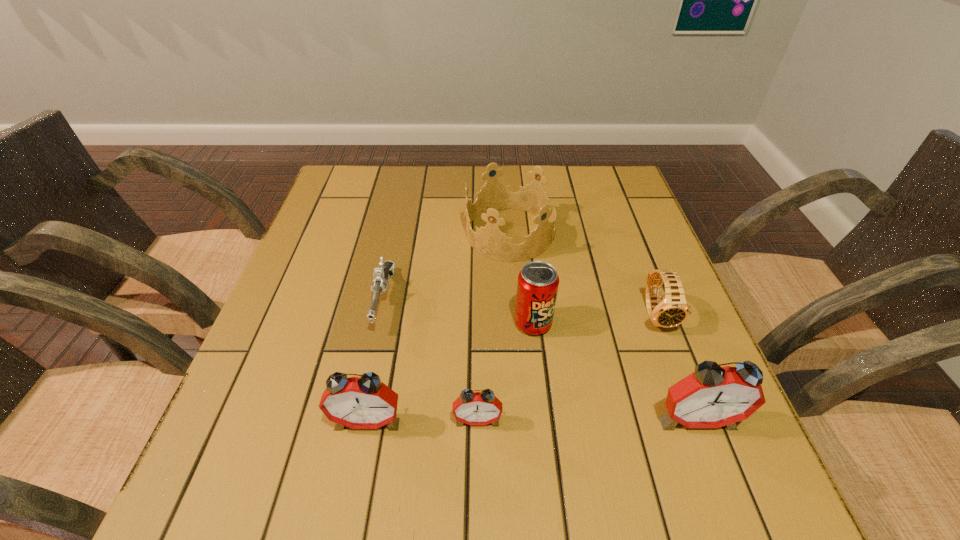
At what (x,y) coordinates should I click in order to perform the action: click on the leftmost alarm clock. Please return your answer as a coordinate pair (x, y). Looking at the image, I should click on (364, 402).

Find the location of a particular element. This screenshot has width=960, height=540. the second alarm clock from left to right is located at coordinates (472, 408).

Locate an element on the screen. The width and height of the screenshot is (960, 540). the rightmost alarm clock is located at coordinates (713, 396).

You are a GUI agent. You are given a task and a screenshot of the screen. Output one action in this format:
    pyautogui.click(x=<x>, y=<y>)
    Task: Click on the farthest object
    This screenshot has height=540, width=960.
    Given the screenshot: What is the action you would take?
    [x=489, y=241]

The width and height of the screenshot is (960, 540). Find the location of `watch`. watch is located at coordinates (671, 311).

The height and width of the screenshot is (540, 960). I want to click on gun, so click(x=381, y=275).

This screenshot has width=960, height=540. I want to click on soda can, so (538, 281).

This screenshot has height=540, width=960. What are the coordinates of `vacant region located 0.060m on the front-facing side of the farthest object` in the screenshot? It's located at (444, 233).

This screenshot has height=540, width=960. Find the location of `vacant space located on the front-facing side of the farthest object`. vacant space located on the front-facing side of the farthest object is located at coordinates (444, 233).

I want to click on vacant position located on the front-facing side of the farthest object, so click(x=336, y=233).